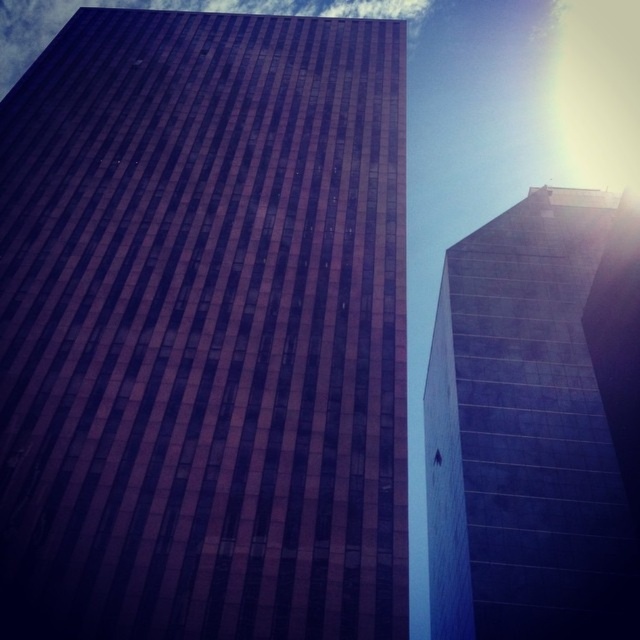
Question: Can you confirm if brown glass building at center is positioned below smooth concrete tower at right?

Choices:
 (A) no
 (B) yes

Answer: (A)

Question: Which point is farther to the camera?

Choices:
 (A) (579, 312)
 (B) (108, 509)

Answer: (A)

Question: Can you confirm if brown glass building at center is bigger than smooth concrete tower at right?

Choices:
 (A) no
 (B) yes

Answer: (B)

Question: Is brown glass building at center closer to camera compared to smooth concrete tower at right?

Choices:
 (A) yes
 (B) no

Answer: (A)